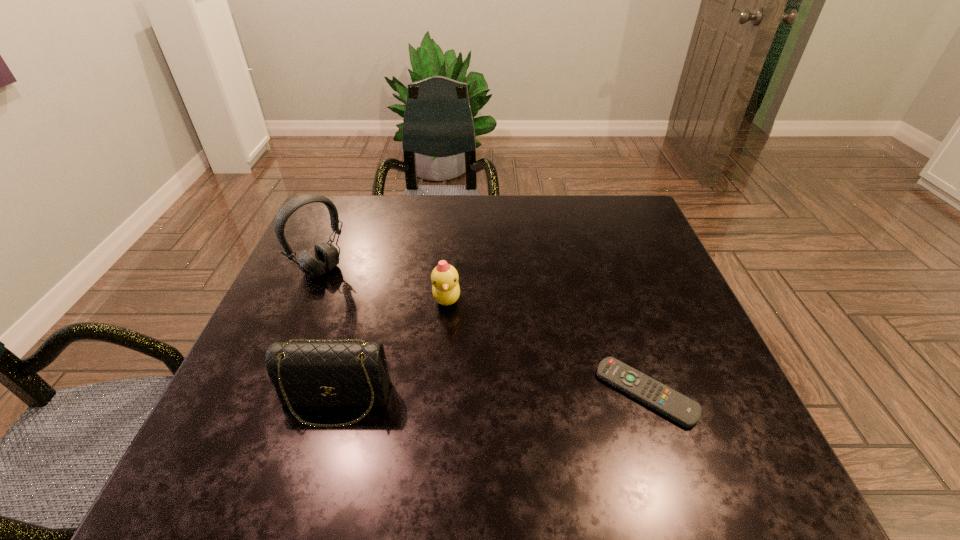
Find the location of `vacant space on the desktop that is between the clutch bag and the shortest object and is positioned on the front-facing side of the duckling`. vacant space on the desktop that is between the clutch bag and the shortest object and is positioned on the front-facing side of the duckling is located at coordinates (511, 395).

This screenshot has width=960, height=540. Identify the location of free space on the desktop that is between the clutch bag and the remote control and is positioned on the front-facing side of the headset. (472, 396).